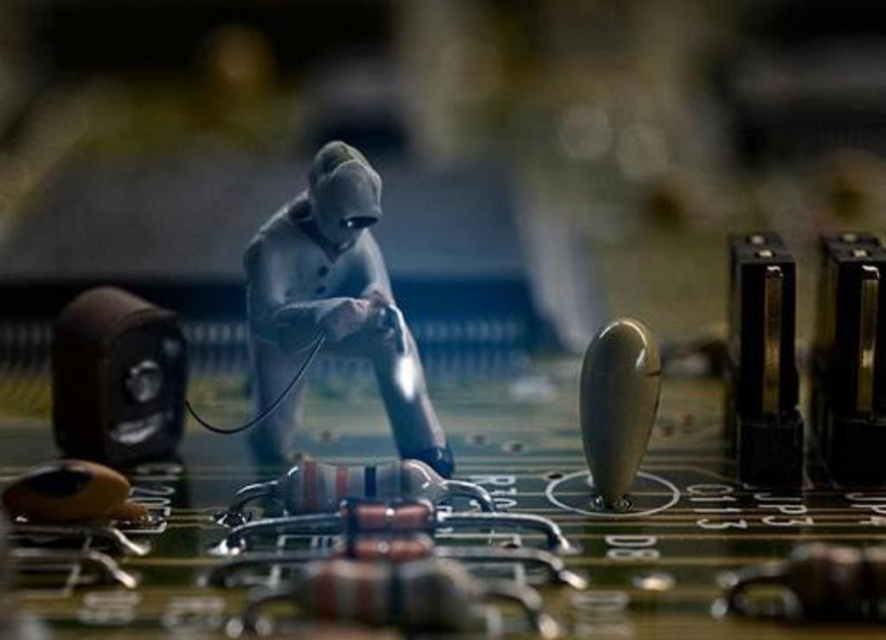
Does point (402, 396) lie behind point (643, 404)?

Yes, point (402, 396) is behind point (643, 404).

Is silver metallic figure at center to the left of matte gray knob at center-right from the viewer's perspective?

Yes, silver metallic figure at center is to the left of matte gray knob at center-right.

In order to click on silver metallic figure at center in this screenshot , I will do `click(335, 298)`.